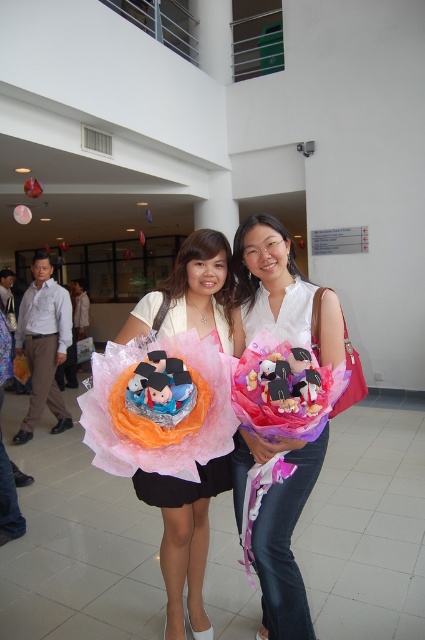
Consider the image. Between white matte shirt at center and matte pink fabric dress at center, which one appears on the right side from the viewer's perspective?

white matte shirt at center is more to the right.

Is white matte shirt at center positioned before matte pink fabric dress at center?

Yes, it is.

Where is `white matte shirt at center`? The width and height of the screenshot is (425, 640). white matte shirt at center is located at coordinates (278, 529).

Identify the location of white matte shirt at center. The width and height of the screenshot is (425, 640). (278, 529).

Which is behind, point (169, 544) or point (135, 317)?

The point (169, 544) is behind.

Who is taller, matte pink fabric at center or matte pink fabric dress at center?

matte pink fabric at center

Is point (175, 273) farther from viewer compared to point (175, 307)?

Yes, it is behind point (175, 307).

Where is `matte pink fabric at center`? This screenshot has height=640, width=425. matte pink fabric at center is located at coordinates click(x=184, y=538).

Does white matte shirt at center appear on the right side of matte pink fabric at center?

Yes, white matte shirt at center is to the right of matte pink fabric at center.

Is white matte shirt at center positioned in front of matte pink fabric at center?

That is True.

Find the location of a particular element. The height and width of the screenshot is (640, 425). white matte shirt at center is located at coordinates (278, 529).

Identify the location of white matte shirt at center. (278, 529).